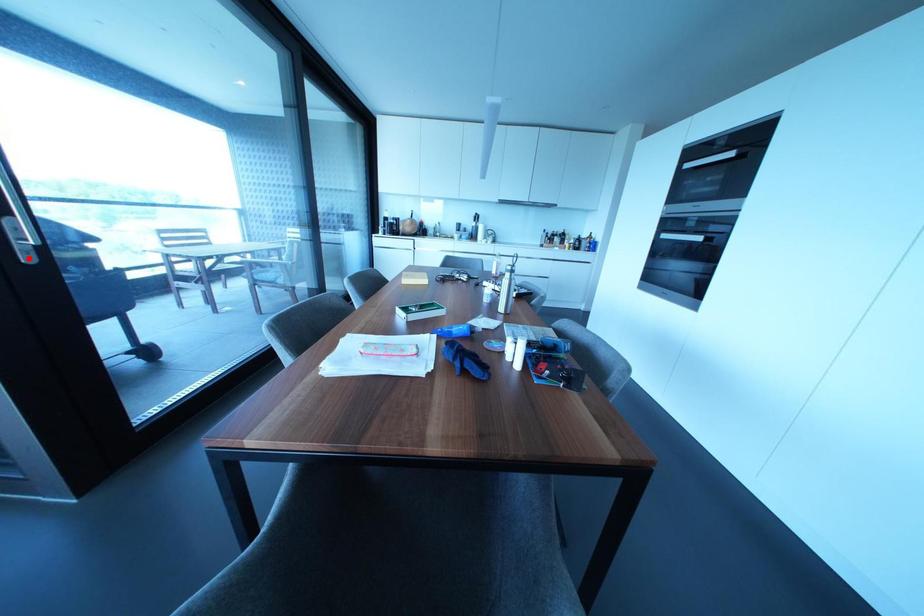
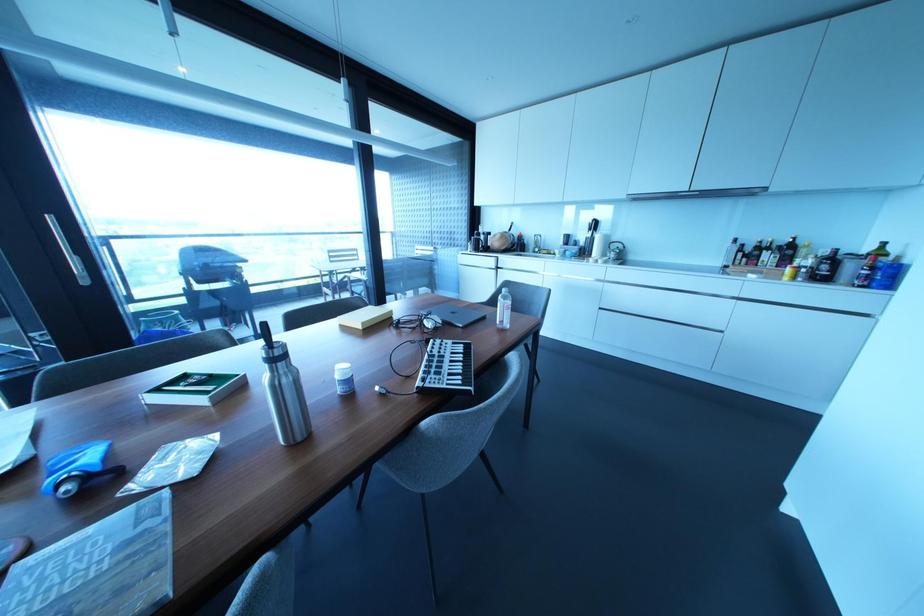
Question: I am providing you with two images of the same scene from different viewpoints. A red point is shown in image1. For the corresponding object point in image2, is it positioned nearer or farther from the camera?

Choices:
 (A) Nearer
 (B) Farther

Answer: (A)